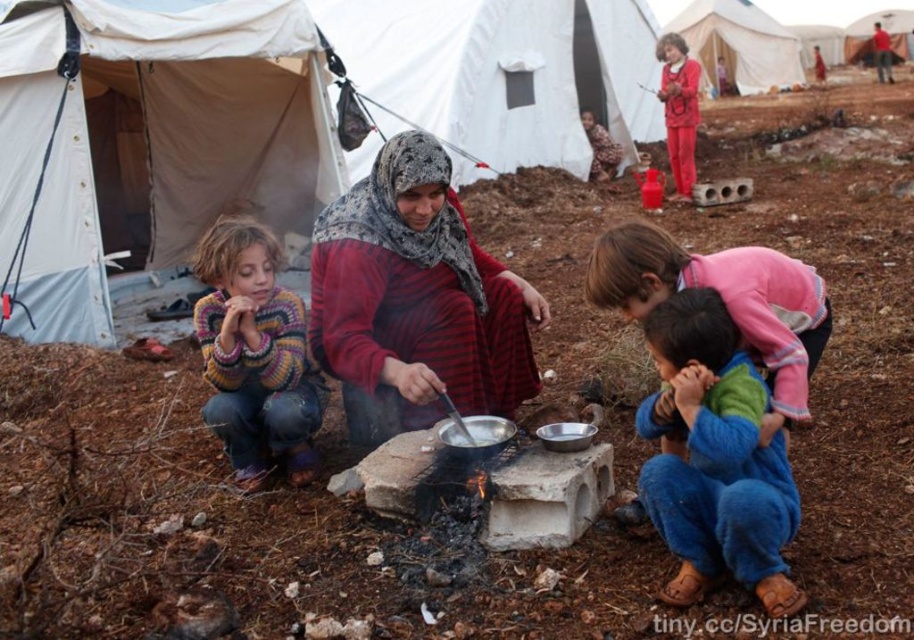
You are a traveler who needs to decide whether to place a 1.2 meter wide box next to the red striped fabric at center and the white canvas tent at upper right. Given their sizes, which object can the box be placed next to without exceeding its width?

The red striped fabric at center has a width less than the white canvas tent at upper right, so the box can be placed next to the white canvas tent at upper right since it is wider than the box.

You are a traveler approaching the campsite and need to locate the white canvas tent at left. Based on the scene, where would you find it in relation to the brown textured blanket at upper center?

The white canvas tent at left is located below the brown textured blanket at upper center, so you would find it positioned lower on the image, beneath the blanket.